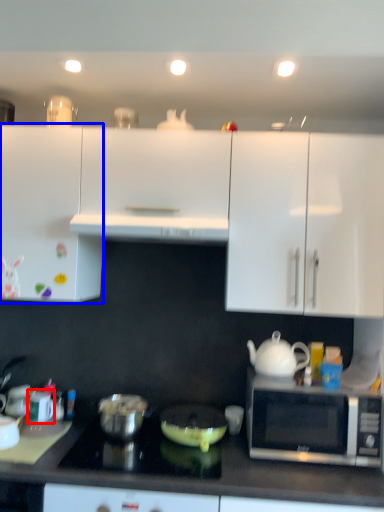
Question: Which point is further to the camera, appliance (highlighted by a red box) or cabinetry (highlighted by a blue box)?

Choices:
 (A) appliance
 (B) cabinetry

Answer: (A)